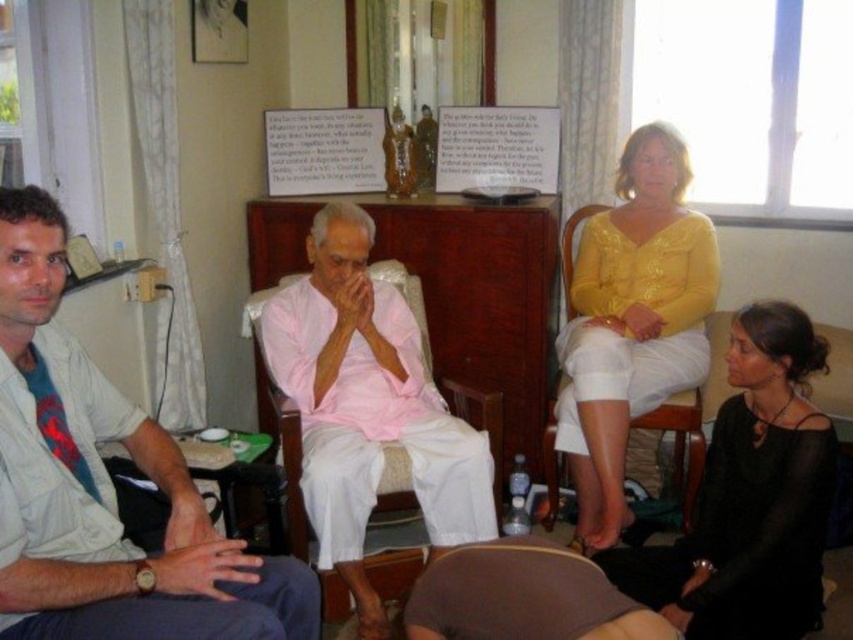
You are organizing a closet and need to place the black sheer dress at lower right and the yellow shiny blouse at upper right. Given their sizes, which one requires more horizontal space when hanging?

The black sheer dress at lower right requires more horizontal space when hanging since its width is larger than the yellow shiny blouse at upper right.

Based on the photo, you are organizing a small tea ceremony and need to decide which item to use as a table cover. Based on the scene, which object is more suitable between the pink cotton cloth at center and the brown fabric cushion at lower center?

The pink cotton cloth at center is larger in size than the brown fabric cushion at lower center, so it is more suitable to use as a table cover.

From the picture: You are a photographer setting up for a photoshoot in the room. You need to position a light source to illuminate the black sheer dress at lower right and the yellow shiny blouse at upper right. Based on their positions, which object is closer to the floor?

The black sheer dress at lower right is located below the yellow shiny blouse at upper right, so it is closer to the floor.